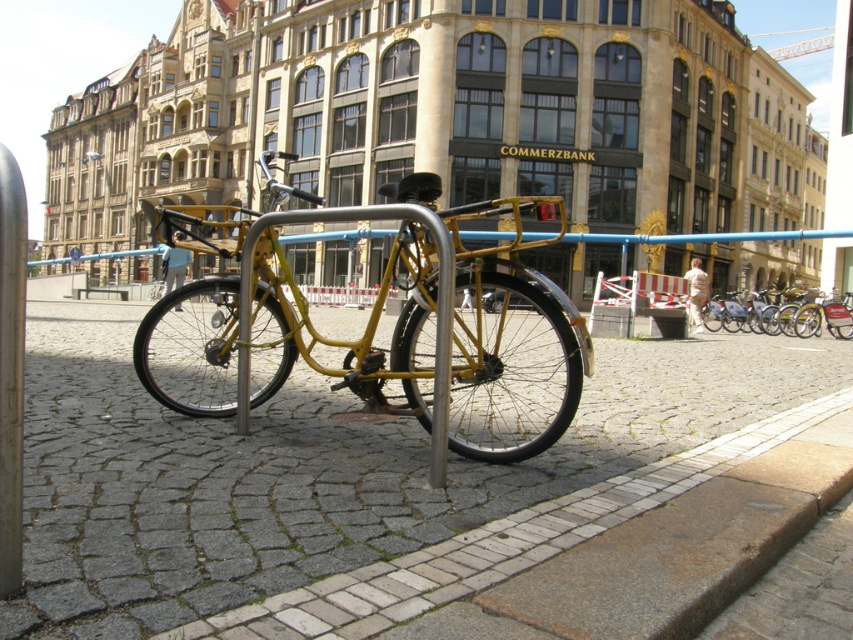
You are a delivery person who needs to place a box on the ground. The box is 10 cm tall. You have two options to place it on either the smooth cobblestone pavement at center or the yellow matte bicycle at center. Which surface can you place the box on without it toppling over?

The smooth cobblestone pavement at center is not as tall as the yellow matte bicycle at center, so placing the box on the yellow matte bicycle at center would be safer as it provides a higher and more stable surface to prevent toppling.

You are standing in front of the COMMERZBANK building and notice two points marked on the facade. The first point is at coordinates point (77, 518) and the second is at point (809, 312). Which point is closer to your current position?

Point (77, 518) is closer to the camera than point (809, 312), so the first point is closer to your current position.

You are a delivery person trying to move the yellow matte bicycle at center to the side of the smooth cobblestone pavement at center. Can you fit the bicycle alongside the pavement without moving it off the street?

The smooth cobblestone pavement at center is narrower than the yellow matte bicycle at center, so the bicycle cannot be placed alongside the pavement without extending beyond its width. You would need to move it to a wider area.